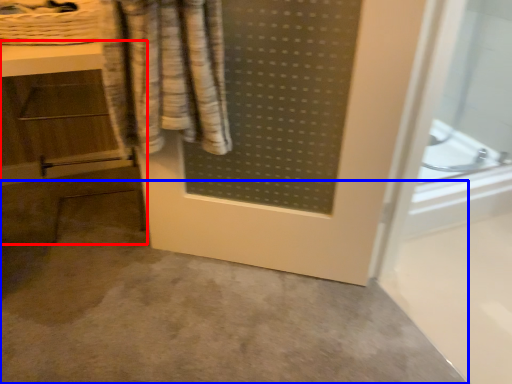
Question: Which of the following is the closest to the observer, vanity (highlighted by a red box) or concrete (highlighted by a blue box)?

Choices:
 (A) vanity
 (B) concrete

Answer: (B)